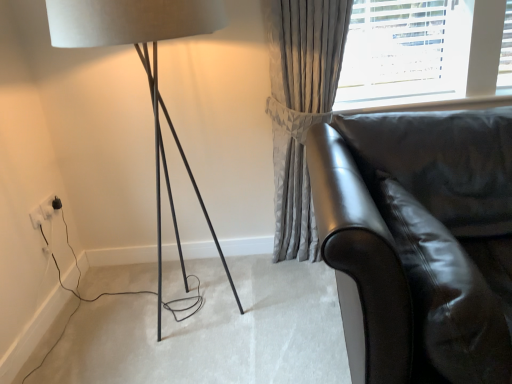
Question: From the image's perspective, is matte black lamp at left positioned above or below glossy leather swivel chair at lower right?

Choices:
 (A) below
 (B) above

Answer: (B)

Question: Looking at the image, does matte black lamp at left seem bigger or smaller compared to glossy leather swivel chair at lower right?

Choices:
 (A) small
 (B) big

Answer: (B)

Question: Based on their relative distances, which object is nearer to the white plastic electric outlet at lower left, marked as the 2th electric outlet in a front-to-back arrangement?

Choices:
 (A) glossy leather swivel chair at lower right
 (B) satin grey curtain at upper right
 (C) shiny black leather couch at right
 (D) white plastic electric outlet at lower left, acting as the first electric outlet starting from the front
 (E) matte black lamp at left

Answer: (D)

Question: Estimate the real-world distances between objects in this image. Which object is closer to the satin grey curtain at upper right?

Choices:
 (A) white plastic electric outlet at lower left, marked as the 1th electric outlet in a back-to-front arrangement
 (B) matte black lamp at left
 (C) shiny black leather couch at right
 (D) glossy leather swivel chair at lower right
 (E) white plastic electric outlet at lower left, which is counted as the 2th electric outlet, starting from the back

Answer: (B)